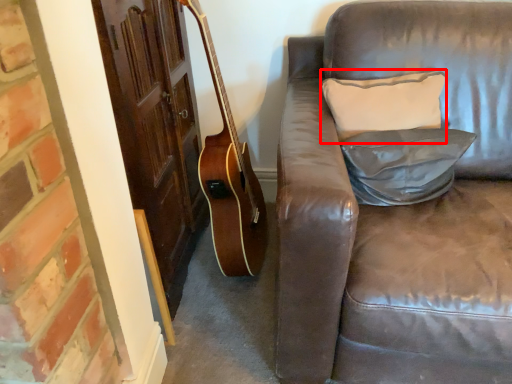
Question: In this image, where is pillow (annotated by the red box) located relative to pillow?

Choices:
 (A) right
 (B) left

Answer: (B)